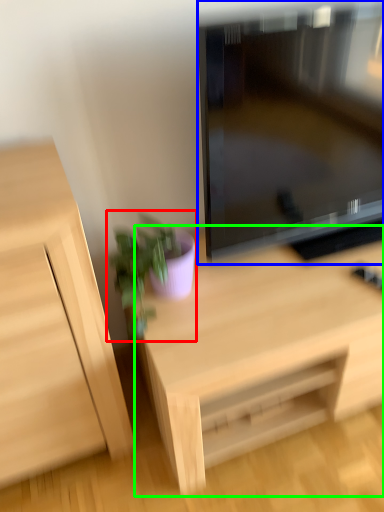
Question: Based on their relative distances, which object is nearer to houseplant (highlighted by a red box)? Choose from television (highlighted by a blue box) and desk (highlighted by a green box).

Choices:
 (A) television
 (B) desk

Answer: (B)